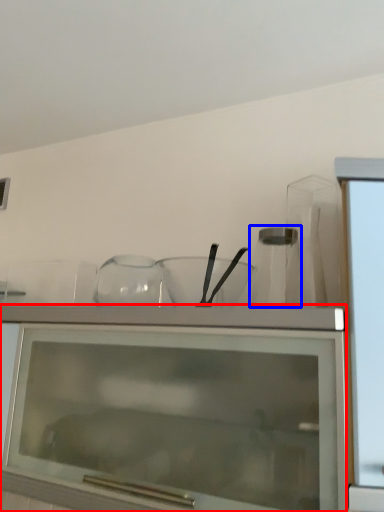
Question: Which object is further to the camera taking this photo, cabinetry (highlighted by a red box) or glass vase (highlighted by a blue box)?

Choices:
 (A) cabinetry
 (B) glass vase

Answer: (B)